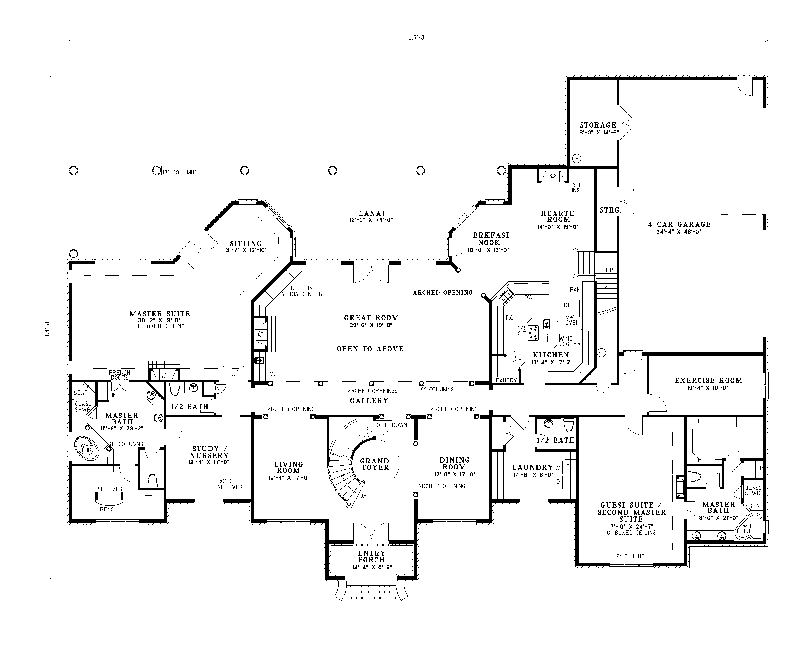
Locate an element on the screen. The height and width of the screenshot is (671, 800). grand foyer is located at coordinates (326, 415), (329, 498), (414, 503), (412, 421).